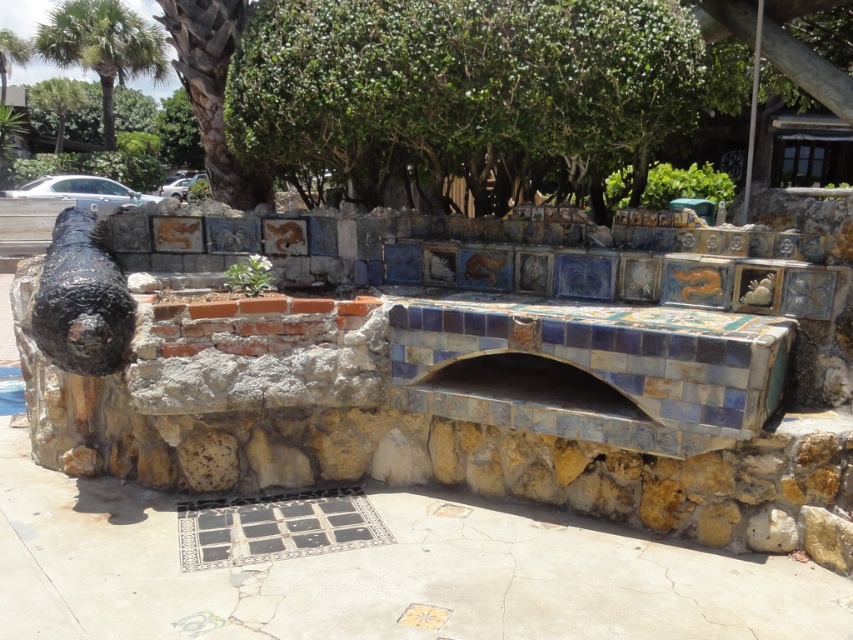
From the picture: You are standing in front of the outdoor structure and want to take a photo that includes both the rusty metal cannon at left and the green leafy palm tree at upper left. Which object should you position closer to the center of your camera frame to ensure both are fully visible?

You should position the green leafy palm tree at upper left closer to the center of your camera frame because it is taller than the rusty metal cannon at left, so centering it will help ensure both are fully visible in the photo.